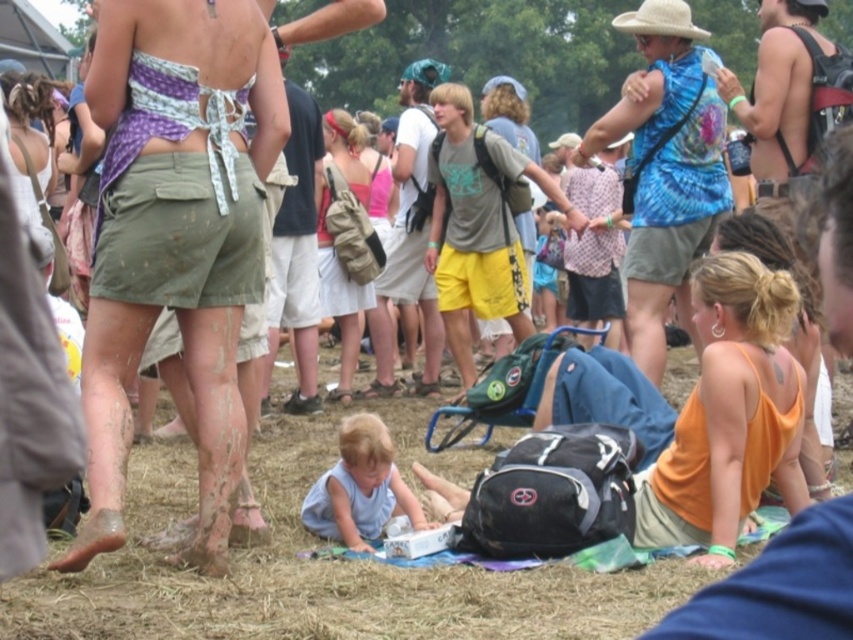
Is point (123, 220) farther from viewer compared to point (368, 193)?

No, (123, 220) is in front of (368, 193).

This screenshot has height=640, width=853. What are the coordinates of `matte purple bikini top at upper left` in the screenshot? It's located at (177, 237).

Which is more to the left, orange matte tank top at lower right or light blue fabric at lower center?

light blue fabric at lower center is more to the left.

Can you confirm if orange matte tank top at lower right is shorter than light blue fabric at lower center?

In fact, orange matte tank top at lower right may be taller than light blue fabric at lower center.

The height and width of the screenshot is (640, 853). I want to click on orange matte tank top at lower right, so click(x=732, y=412).

Which is below, orange matte tank top at lower right or matte pink tank top at center?

Positioned lower is orange matte tank top at lower right.

Which is more to the left, orange matte tank top at lower right or matte pink tank top at center?

Positioned to the left is matte pink tank top at center.

Is point (732, 269) farther from viewer compared to point (369, 196)?

No, it is not.

Where is `orange matte tank top at lower right`? This screenshot has width=853, height=640. orange matte tank top at lower right is located at coordinates (732, 412).